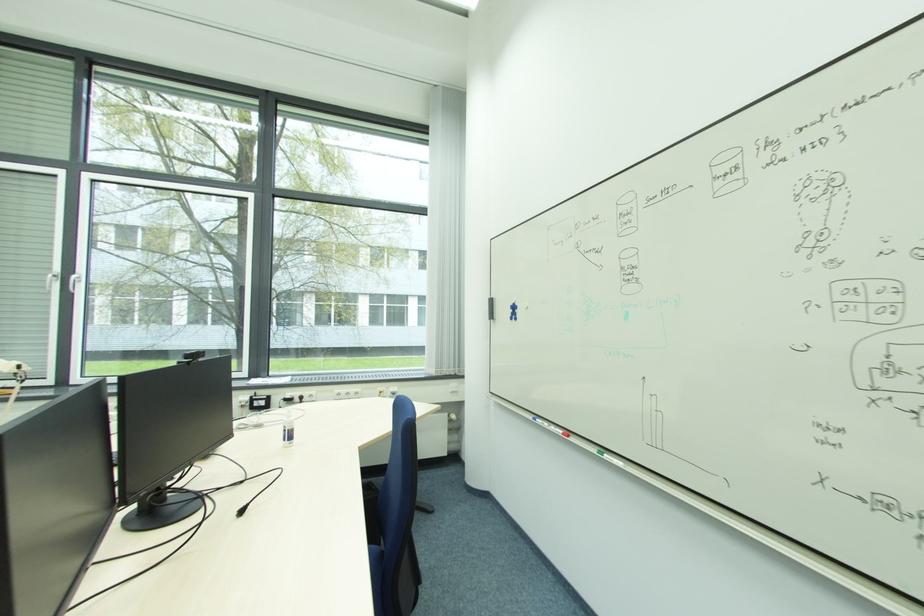
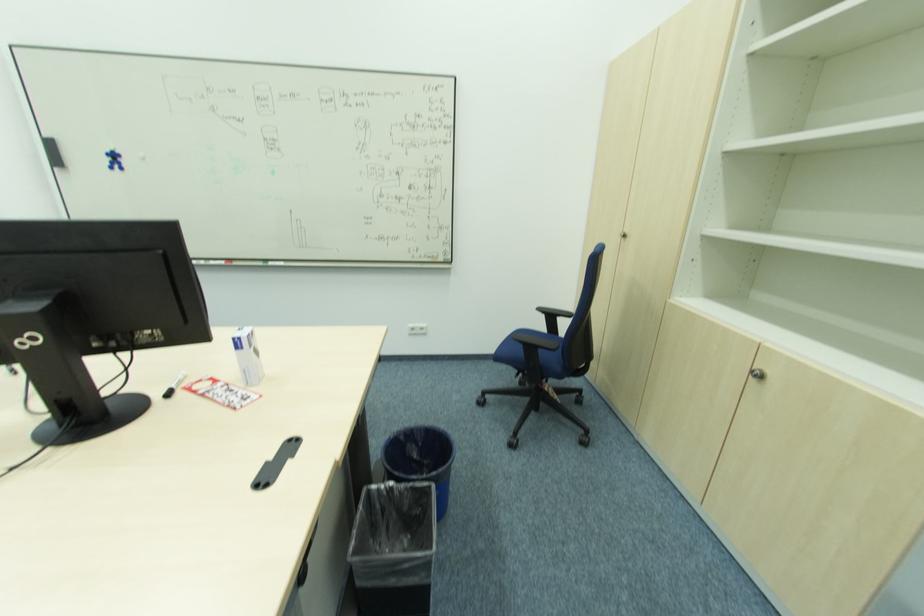
Where in the second image is the point corresponding to the point at 515,313 from the first image?

(116, 161)